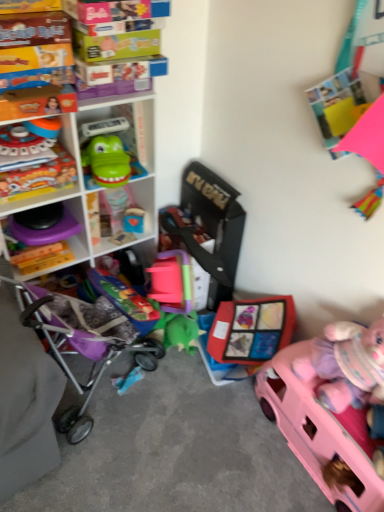
Find the location of `free space above matte plastic toy at center, acting as the second toy starting from the right (from a real-world perspective)`. free space above matte plastic toy at center, acting as the second toy starting from the right (from a real-world perspective) is located at coordinates (219, 342).